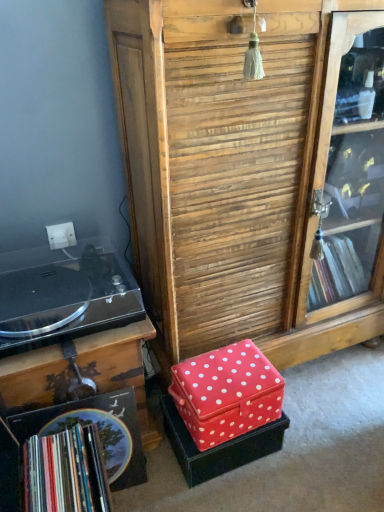
Question: From a real-world perspective, is wooden at center positioned under red fabric box at center, the first storage box positioned from the bottom, based on gravity?

Choices:
 (A) no
 (B) yes

Answer: (A)

Question: From a real-world perspective, is wooden at center located higher than red fabric box at center, the second storage box positioned from the top?

Choices:
 (A) no
 (B) yes

Answer: (B)

Question: Does wooden at center have a larger size compared to red fabric box at center, the second storage box positioned from the top?

Choices:
 (A) no
 (B) yes

Answer: (B)

Question: Does wooden at center have a smaller size compared to red fabric box at center, the first storage box positioned from the bottom?

Choices:
 (A) yes
 (B) no

Answer: (B)

Question: Is wooden at center taller than red fabric box at center, the second storage box positioned from the top?

Choices:
 (A) yes
 (B) no

Answer: (A)

Question: Considering the positions of point (266, 90) and point (196, 455), is point (266, 90) closer or farther from the camera than point (196, 455)?

Choices:
 (A) closer
 (B) farther

Answer: (A)

Question: From the image's perspective, is wooden at center above or below red fabric box at center, the first storage box positioned from the bottom?

Choices:
 (A) below
 (B) above

Answer: (B)

Question: Do you think wooden at center is within red fabric box at center, the first storage box positioned from the bottom, or outside of it?

Choices:
 (A) inside
 (B) outside

Answer: (B)

Question: Looking at their shapes, would you say wooden at center is wider or thinner than red fabric box at center, the second storage box positioned from the top?

Choices:
 (A) thin
 (B) wide

Answer: (B)

Question: Looking at their shapes, would you say black plastic record player at left is wider or thinner than multicolored paper book at lower left?

Choices:
 (A) thin
 (B) wide

Answer: (B)

Question: In terms of size, does black plastic record player at left appear bigger or smaller than multicolored paper book at lower left?

Choices:
 (A) small
 (B) big

Answer: (B)

Question: In the image, is black plastic record player at left positioned in front of or behind multicolored paper book at lower left?

Choices:
 (A) front
 (B) behind

Answer: (B)

Question: Is black plastic record player at left spatially inside multicolored paper book at lower left, or outside of it?

Choices:
 (A) outside
 (B) inside

Answer: (A)

Question: Considering the positions of red fabric box at lower center, which is the 2th storage box in bottom-to-top order, and red fabric box at center, the second storage box positioned from the top, in the image, is red fabric box at lower center, which is the 2th storage box in bottom-to-top order, wider or thinner than red fabric box at center, the second storage box positioned from the top,?

Choices:
 (A) wide
 (B) thin

Answer: (B)

Question: In the image, is red fabric box at lower center, which is the 1th storage box from top to bottom, positioned in front of or behind red fabric box at center, the second storage box positioned from the top?

Choices:
 (A) front
 (B) behind

Answer: (A)